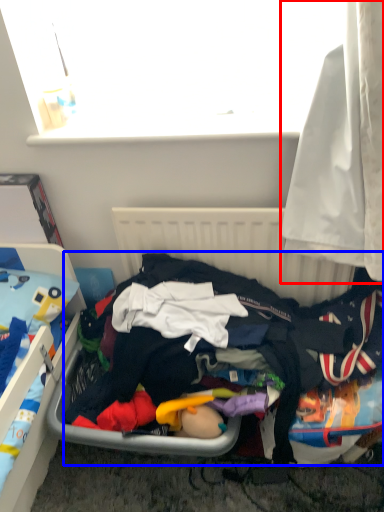
Question: Which point is further to the camera, curtain (highlighted by a red box) or clothing (highlighted by a blue box)?

Choices:
 (A) curtain
 (B) clothing

Answer: (B)